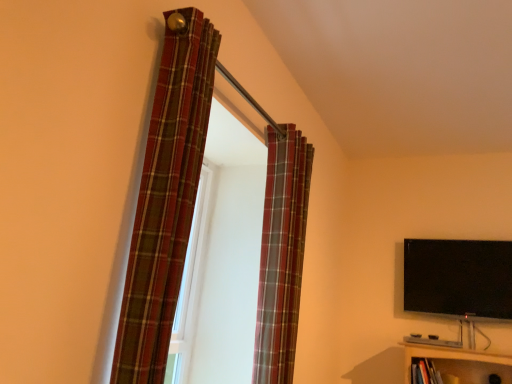
Question: From the image's perspective, is black glossy flat-screen tv at upper right above or below plaid fabric curtain at upper center, which is the second curtain from left to right?

Choices:
 (A) below
 (B) above

Answer: (A)

Question: Considering the positions of black glossy flat-screen tv at upper right and plaid fabric curtain at upper center, the first curtain viewed from the back, in the image, is black glossy flat-screen tv at upper right bigger or smaller than plaid fabric curtain at upper center, the first curtain viewed from the back,?

Choices:
 (A) small
 (B) big

Answer: (A)

Question: Based on their relative distances, which object is nearer to the plaid fabric curtain at upper center, the 1th curtain in the right-to-left sequence?

Choices:
 (A) black glossy flat-screen tv at upper right
 (B) plaid fabric curtain at left, placed as the 2th curtain when sorted from right to left

Answer: (B)

Question: Based on their relative distances, which object is nearer to the plaid fabric curtain at upper center, the first curtain viewed from the back?

Choices:
 (A) black glossy flat-screen tv at upper right
 (B) plaid fabric curtain at left, marked as the first curtain in a left-to-right arrangement

Answer: (B)